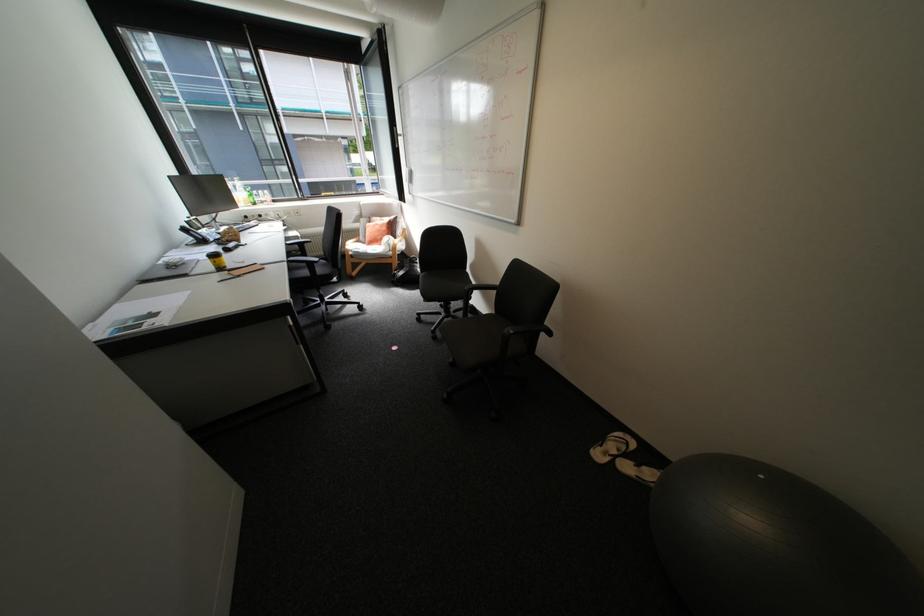
What do you see at coordinates (249, 195) in the screenshot?
I see `the green plastic bottle` at bounding box center [249, 195].